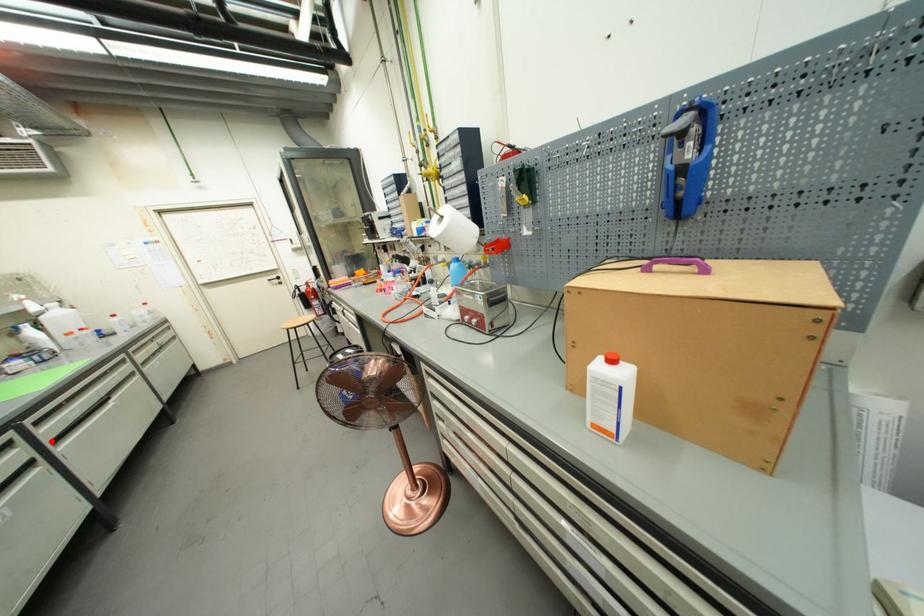
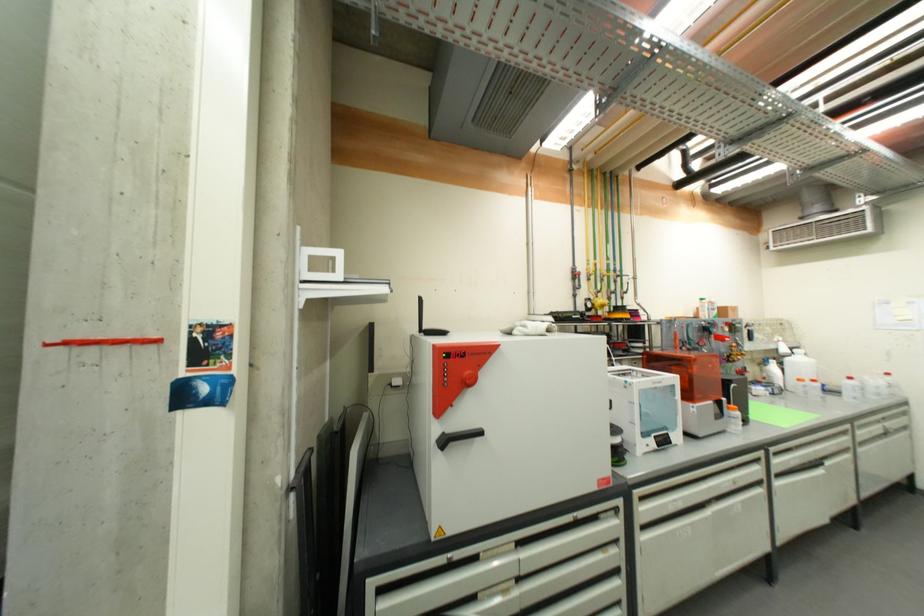
Question: I am providing you with two images of the same scene from different viewpoints. Image1 has a red point marked. In image2, the corresponding 3D location appears at what relative position? Reply with the corresponding letter.

Choices:
 (A) Closer
 (B) Farther

Answer: (A)